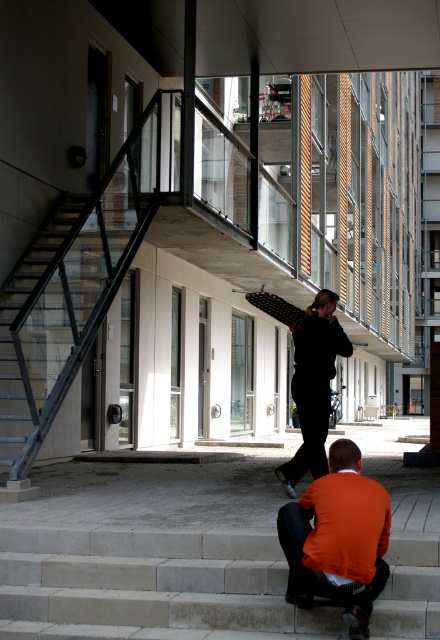
Question: Which is farther from the orange sweater at lower center?

Choices:
 (A) concrete steps at lower center
 (B) black matte pants at center

Answer: (B)

Question: Which point appears closest to the camera in this image?

Choices:
 (A) (80, 547)
 (B) (290, 496)

Answer: (A)

Question: Is concrete steps at lower center further to the viewer compared to black matte pants at center?

Choices:
 (A) yes
 (B) no

Answer: (B)

Question: Does concrete steps at lower center come in front of black matte pants at center?

Choices:
 (A) yes
 (B) no

Answer: (A)

Question: Which of the following is the closest to the observer?

Choices:
 (A) concrete steps at lower center
 (B) orange sweater at lower center

Answer: (B)

Question: Does concrete steps at lower center come behind black matte pants at center?

Choices:
 (A) no
 (B) yes

Answer: (A)